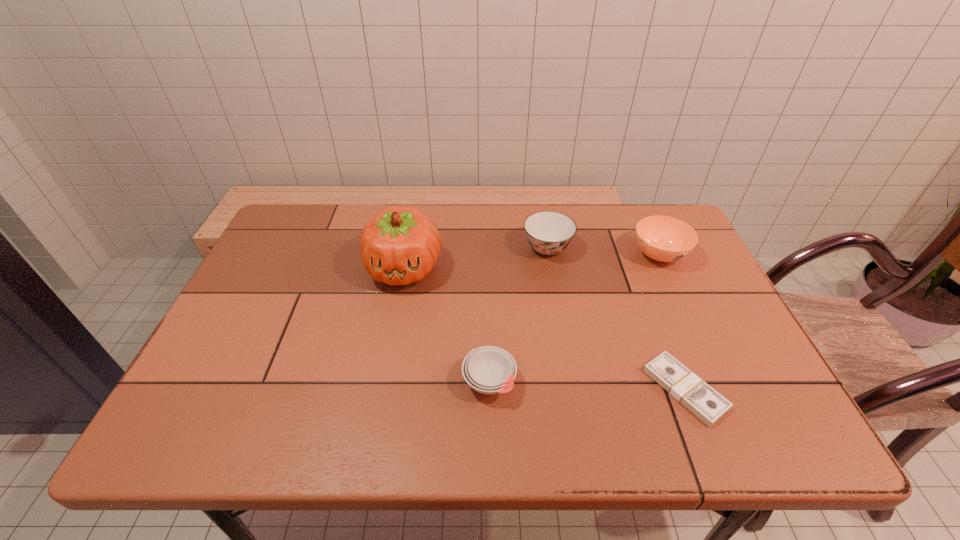
Locate an element on the screen. blank space located on the back of the second object from left to right is located at coordinates (488, 298).

You are a GUI agent. You are given a task and a screenshot of the screen. Output one action in this format:
    pyautogui.click(x=<x>, y=<y>)
    Task: Click on the vacant region located on the right of the dollar
    Image resolution: width=960 pixels, height=540 pixels.
    Given the screenshot: What is the action you would take?
    pyautogui.click(x=754, y=389)

Where is `pumpkin at the far edge`? The height and width of the screenshot is (540, 960). pumpkin at the far edge is located at coordinates (400, 245).

This screenshot has height=540, width=960. Find the location of `object situated at the near edge`. object situated at the near edge is located at coordinates (703, 401).

Identify the location of soup bowl that is at the right edge. The image size is (960, 540). (665, 239).

Where is `dollar that is at the right edge`? The height and width of the screenshot is (540, 960). dollar that is at the right edge is located at coordinates (703, 401).

The width and height of the screenshot is (960, 540). What are the coordinates of `object that is at the far right corner` in the screenshot? It's located at (665, 239).

Identify the location of object that is at the near right corner. (703, 401).

At what (x,y) coordinates should I click in order to perform the action: click on vacant space at the far edge of the desktop. Please return your answer as a coordinate pair (x, y). This screenshot has height=540, width=960. Looking at the image, I should click on (472, 206).

At what (x,y) coordinates should I click in order to perform the action: click on vacant region at the near edge of the desktop. Please return your answer as a coordinate pair (x, y). This screenshot has height=540, width=960. Looking at the image, I should click on (529, 421).